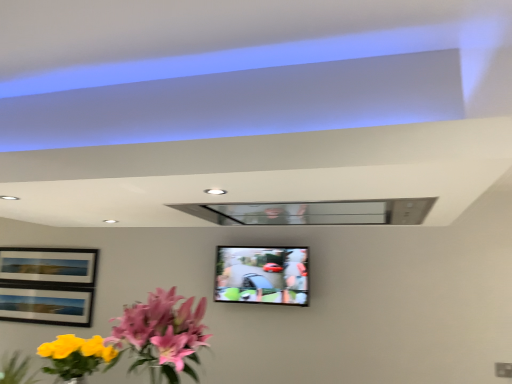
Question: Is pink glossy flowers at lower left in front of or behind matte black tv at center in the image?

Choices:
 (A) front
 (B) behind

Answer: (A)

Question: Visually, is pink glossy flowers at lower left positioned to the left or to the right of matte black tv at center?

Choices:
 (A) right
 (B) left

Answer: (B)

Question: From a real-world perspective, is pink glossy flowers at lower left positioned above or below matte black tv at center?

Choices:
 (A) above
 (B) below

Answer: (B)

Question: Looking at their shapes, would you say matte black tv at center is wider or thinner than pink glossy flowers at lower left?

Choices:
 (A) thin
 (B) wide

Answer: (A)

Question: Is matte black tv at center taller or shorter than pink glossy flowers at lower left?

Choices:
 (A) short
 (B) tall

Answer: (A)

Question: Considering their positions, is matte black tv at center located in front of or behind pink glossy flowers at lower left?

Choices:
 (A) behind
 (B) front

Answer: (A)

Question: Based on their positions, is matte black tv at center located to the left or right of pink glossy flowers at lower left?

Choices:
 (A) right
 (B) left

Answer: (A)